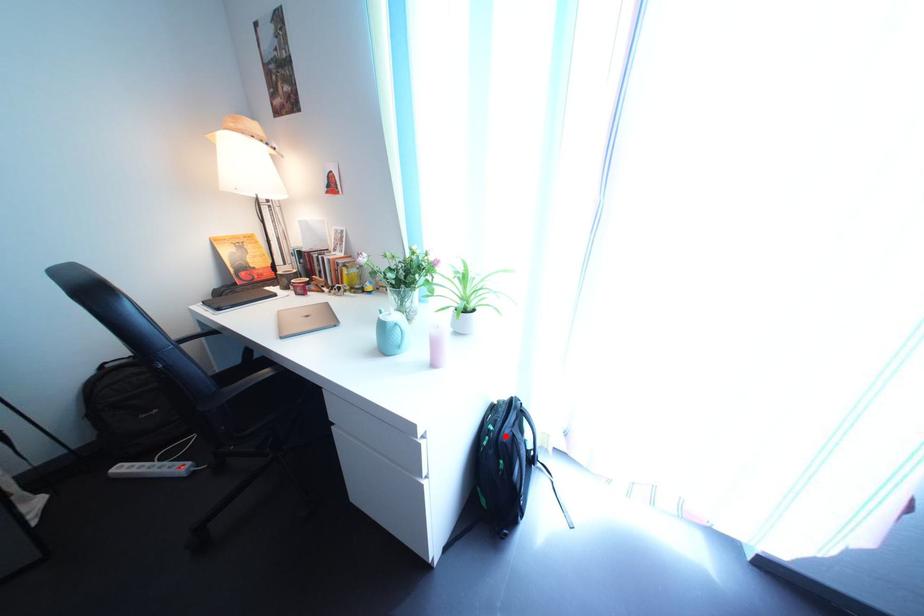
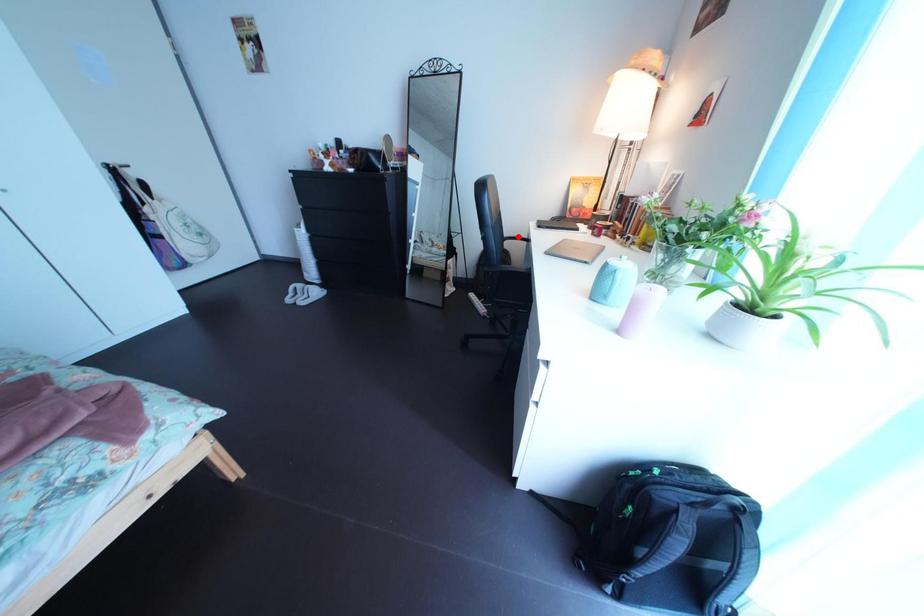
I am providing you with two images of the same scene from different viewpoints. A red point is marked on the first image and another point is marked on the second image. Does the point marked in image1 correspond to the same location as the one in image2?

No